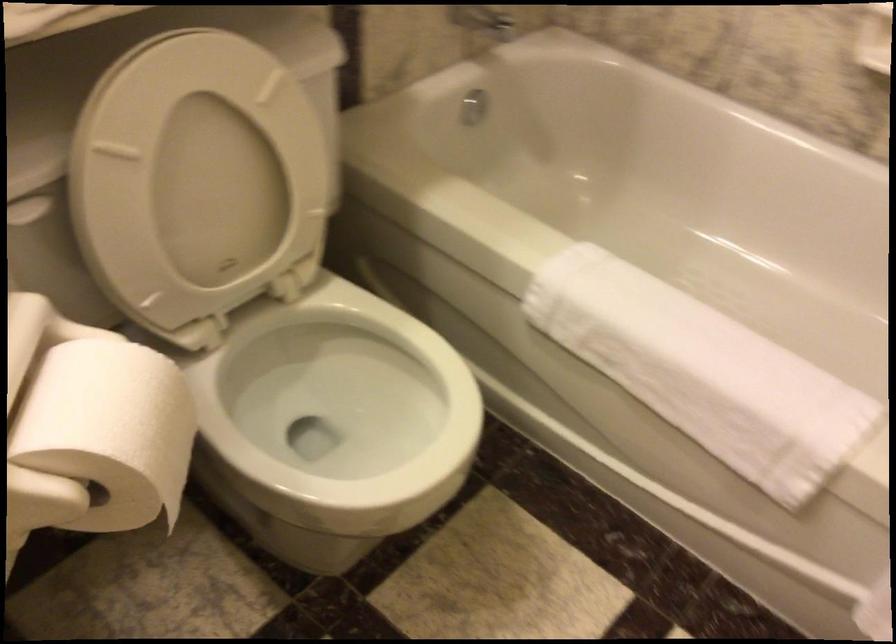
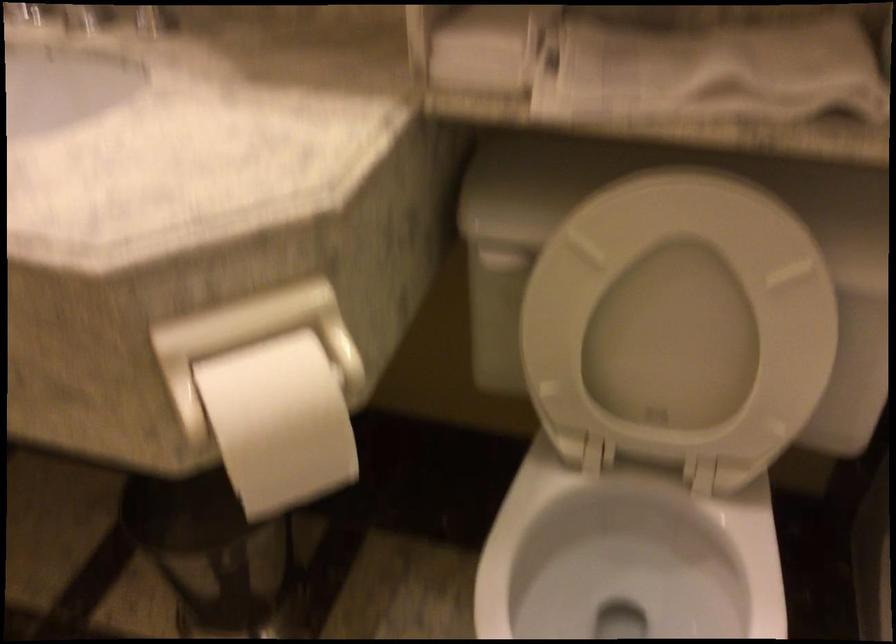
In the second image, find the point that corresponds to point (207, 182) in the first image.

(678, 322)